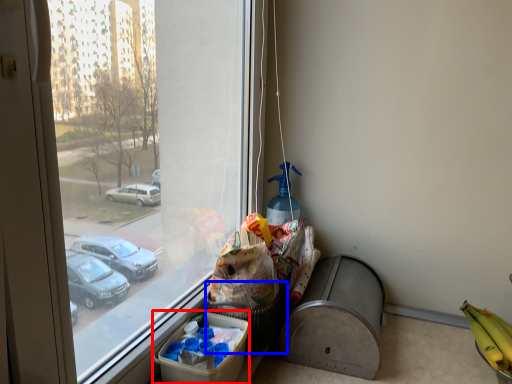
Question: Which of the following is the farthest to the observer, cardboard box (highlighted by a red box) or basket (highlighted by a blue box)?

Choices:
 (A) cardboard box
 (B) basket

Answer: (B)